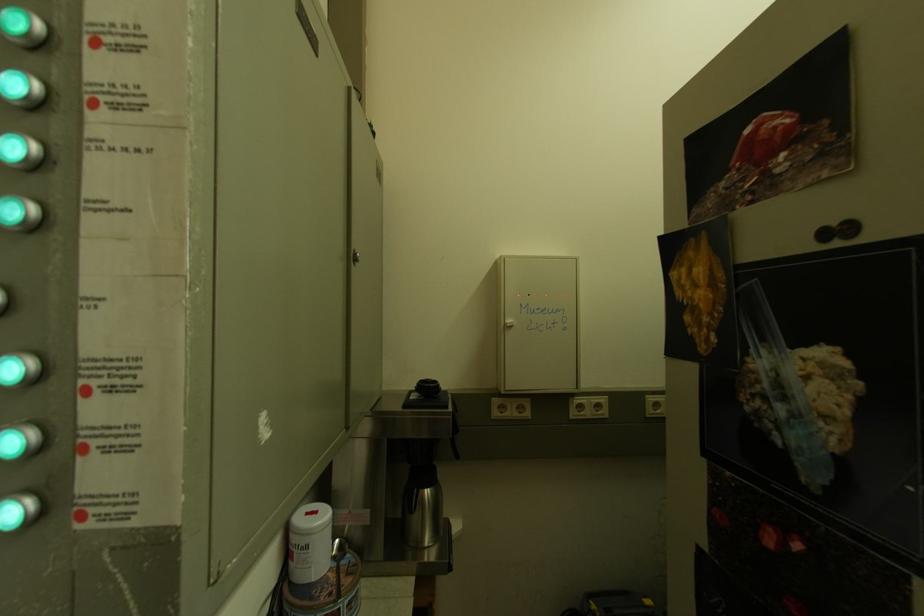
Which object does [427,395] point to?

This point indicates the stainless steel carafe.